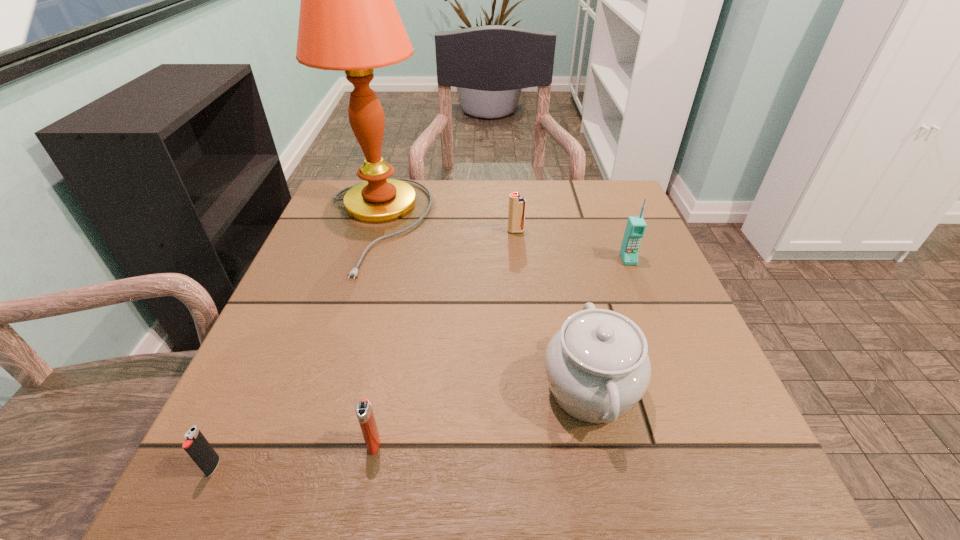
This screenshot has width=960, height=540. Identify the location of lamp. (348, 21).

I want to click on the rightmost object, so click(636, 226).

Find the location of a particular element. The height and width of the screenshot is (540, 960). chinaware is located at coordinates (597, 366).

Find the location of `the farthest igniter`. the farthest igniter is located at coordinates (517, 204).

Find the location of a particular element. the second nearest igniter is located at coordinates (364, 412).

Locate an element on the screen. This screenshot has height=540, width=960. the leftmost igniter is located at coordinates (196, 445).

Locate an element on the screen. The width and height of the screenshot is (960, 540). the shortest object is located at coordinates (196, 445).

What are the coordinates of `free spot located on the right of the lamp` in the screenshot? It's located at (594, 224).

The height and width of the screenshot is (540, 960). I want to click on vacant space located 0.060m on the keypad of the rightmost object, so click(638, 285).

You are a GUI agent. You are given a task and a screenshot of the screen. Output one action in this format:
    pyautogui.click(x=<x>, y=<y>)
    Task: Click on the free location located 0.330m on the back of the chinaware
    The image size is (960, 540).
    Given the screenshot: What is the action you would take?
    click(x=555, y=232)